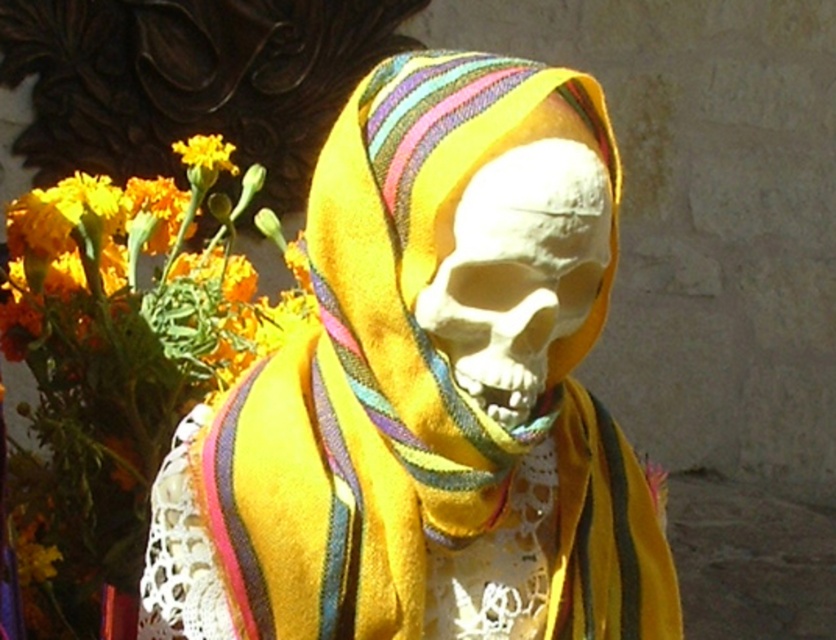
You are an artist observing the scene. You notice the yellow fabric skull at center and the white matte skull at center. Which one is positioned lower in the image?

The yellow fabric skull at center is located below the white matte skull at center, so it is positioned lower in the image.

You are an artist observing the scene. You need to paint the yellow fabric skull at center and the yellow fabric flower at upper left. Which object should you paint first if you want to follow the standard painting technique of starting with objects in the background?

The yellow fabric flower at upper left should be painted first because it is positioned above the yellow fabric skull at center, indicating it is in the background.